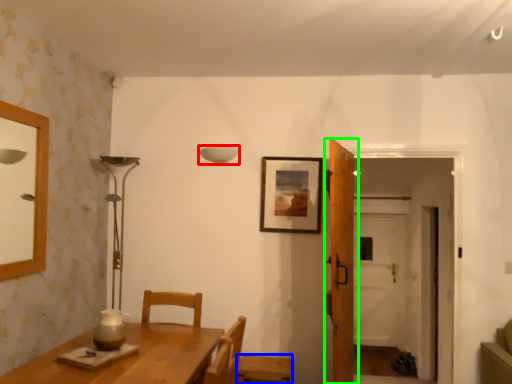
Question: Considering the real-world distances, which object is closest to lamp (highlighted by a red box)? chair (highlighted by a blue box) or door (highlighted by a green box).

Choices:
 (A) chair
 (B) door

Answer: (B)